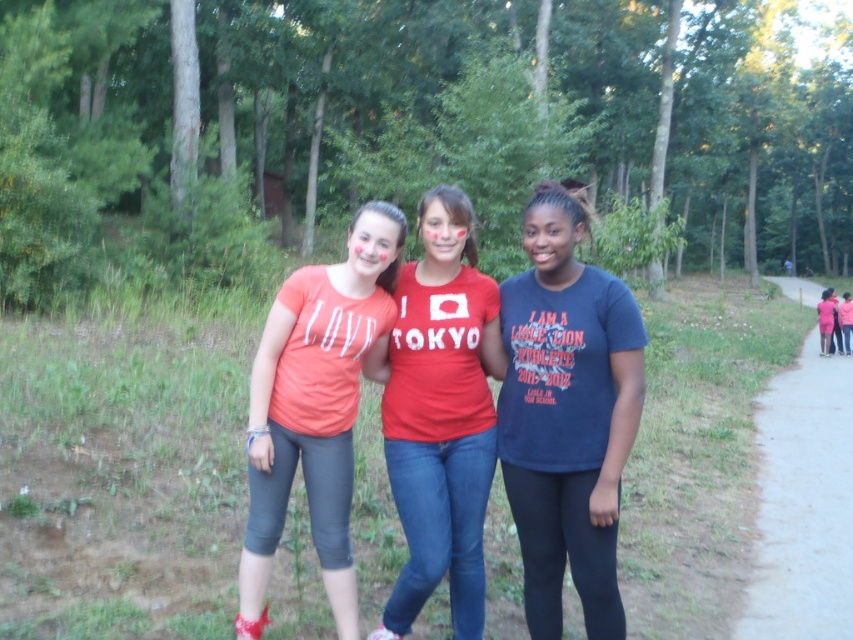
Question: Which of the following is the closest to the observer?

Choices:
 (A) matte red t-shirt at center
 (B) dark blue t-shirt at center

Answer: (B)

Question: Can you confirm if dark blue t-shirt at center is positioned to the right of matte orange t-shirt at center?

Choices:
 (A) no
 (B) yes

Answer: (B)

Question: Does dark blue t-shirt at center appear on the left side of matte orange t-shirt at center?

Choices:
 (A) yes
 (B) no

Answer: (B)

Question: Which of the following is the closest to the observer?

Choices:
 (A) (367, 253)
 (B) (798, 388)
 (C) (566, 506)
 (D) (480, 369)

Answer: (C)

Question: Which object is the closest to the matte red t-shirt at center?

Choices:
 (A) matte orange t-shirt at center
 (B) dark blue t-shirt at center

Answer: (A)

Question: Is matte orange t-shirt at center to the left of gray asphalt path at right from the viewer's perspective?

Choices:
 (A) yes
 (B) no

Answer: (A)